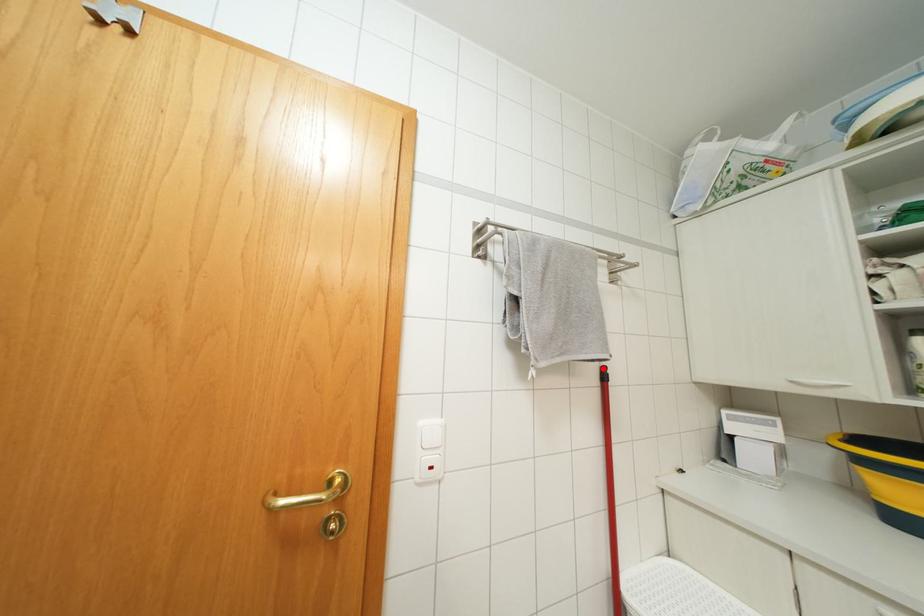
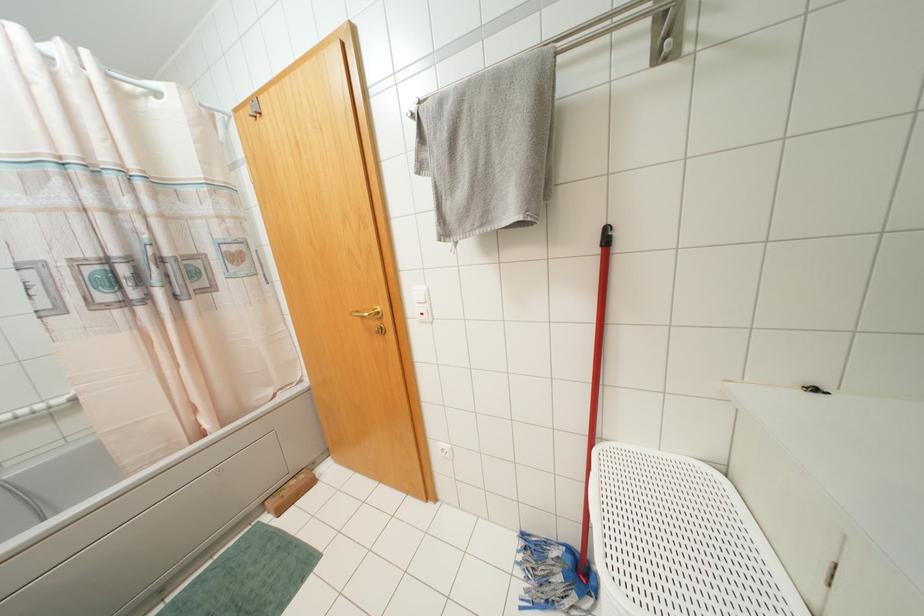
In the second image, find the point that corresponds to the highlighted location in the first image.

(606, 229)